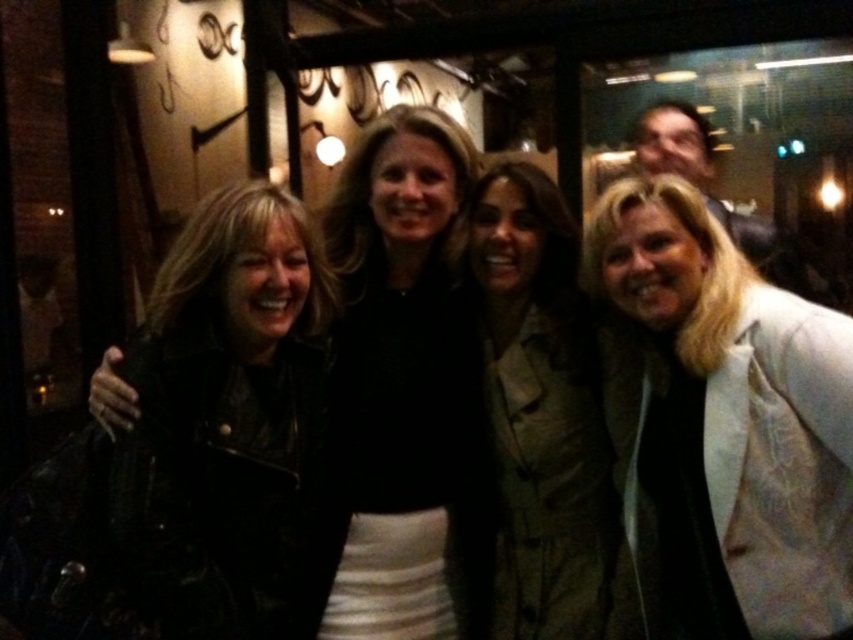
Looking at this image, is white textured blazer at center further to the viewer compared to khaki fabric coat at center?

No, it is not.

Does white textured blazer at center appear on the left side of khaki fabric coat at center?

No, white textured blazer at center is not to the left of khaki fabric coat at center.

Identify the location of white textured blazer at center. The height and width of the screenshot is (640, 853). (727, 426).

The image size is (853, 640). I want to click on white textured blazer at center, so click(727, 426).

Can you confirm if leather jacket at center is positioned below khaki fabric coat at center?

Actually, leather jacket at center is above khaki fabric coat at center.

Is point (334, 442) positioned before point (570, 381)?

Yes.

Is point (315, 596) farther from viewer compared to point (581, 524)?

No, (315, 596) is in front of (581, 524).

In order to click on leather jacket at center in this screenshot , I will do `click(403, 396)`.

Measure the distance between white textured blazer at center and leather jacket at center.

white textured blazer at center is 20.32 inches from leather jacket at center.

Which is in front, point (793, 524) or point (370, 195)?

Point (793, 524) is in front.

What do you see at coordinates (727, 426) in the screenshot? I see `white textured blazer at center` at bounding box center [727, 426].

Identify the location of white textured blazer at center. click(x=727, y=426).